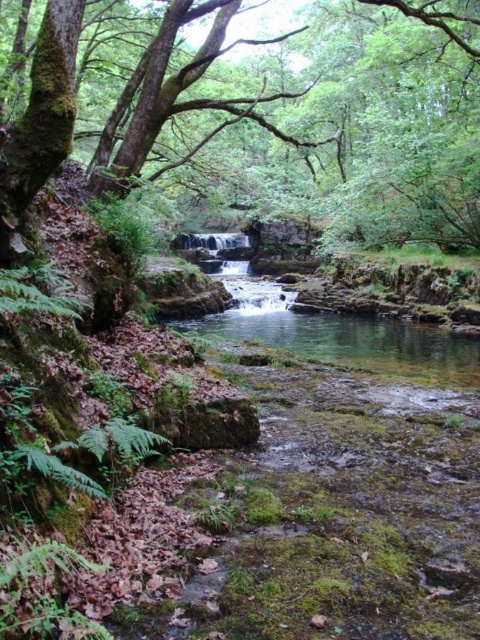
Question: Which point is farther from the camera taking this photo?

Choices:
 (A) (172, 321)
 (B) (440, 58)

Answer: (A)

Question: Which of the following is the closest to the observer?

Choices:
 (A) (468, 20)
 (B) (251, 333)

Answer: (A)

Question: Is green mossy tree at upper left smaller than clear water at center?

Choices:
 (A) no
 (B) yes

Answer: (A)

Question: Which of the following is the farthest from the observer?

Choices:
 (A) (224, 262)
 (B) (444, 246)

Answer: (A)

Question: Is green mossy tree at upper left above clear water at center?

Choices:
 (A) yes
 (B) no

Answer: (A)

Question: Is green mossy tree at upper left in front of clear water at center?

Choices:
 (A) yes
 (B) no

Answer: (A)